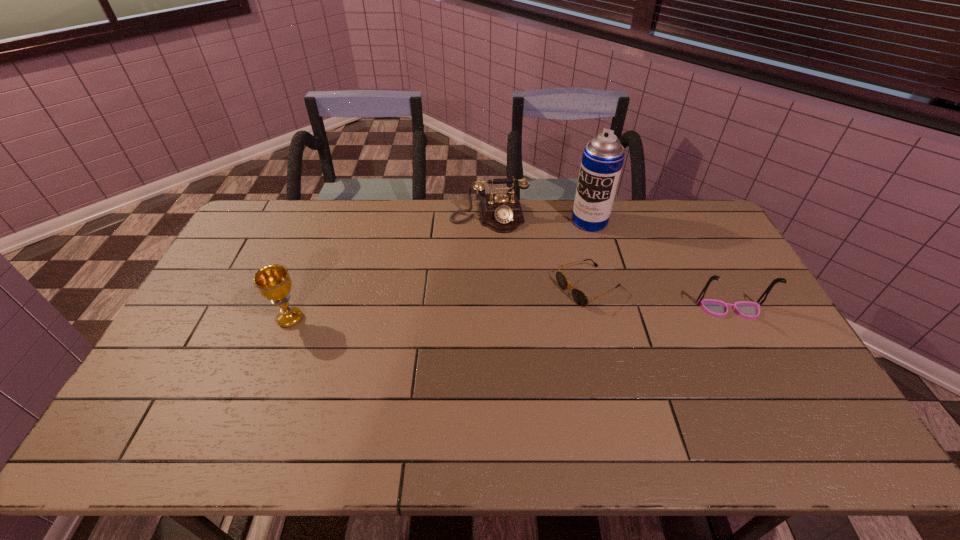
Find the location of `chalice`. chalice is located at coordinates (273, 281).

Where is `spectacles`? spectacles is located at coordinates (748, 310).

Locate an element on the screen. This screenshot has height=540, width=960. the second object from left to right is located at coordinates point(502,213).

You are a GUI agent. You are given a task and a screenshot of the screen. Output one action in this format:
    pyautogui.click(x=<x>, y=<y>)
    Task: Click on the shortest object
    This screenshot has width=960, height=540.
    Given the screenshot: What is the action you would take?
    pyautogui.click(x=580, y=298)

Find the location of a particular element. aerosol can is located at coordinates (602, 160).

Where is `free space located 0.300m on the right of the chalice`? This screenshot has width=960, height=540. free space located 0.300m on the right of the chalice is located at coordinates (408, 319).

This screenshot has width=960, height=540. I want to click on free point located on the back of the spectacles, so click(711, 275).

Find the location of `vacant area situated on the dial of the second object from left to right`. vacant area situated on the dial of the second object from left to right is located at coordinates tap(495, 246).

Locate an element on the screen. The width and height of the screenshot is (960, 540). vacant position located on the dial of the second object from left to right is located at coordinates (506, 312).

Find the location of a particular element. This screenshot has height=540, width=960. free spot located 0.250m on the dial of the second object from left to right is located at coordinates (501, 284).